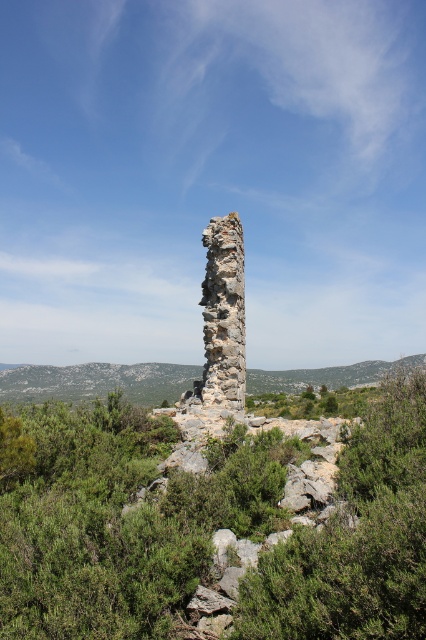
Between green leafy shrub at center and green mossy hillside at center, which one has less height?

With less height is green leafy shrub at center.

Is green leafy shrub at center to the right of green mossy hillside at center from the viewer's perspective?

Indeed, green leafy shrub at center is positioned on the right side of green mossy hillside at center.

Which is behind, point (409, 499) or point (114, 378)?

The point (114, 378) is behind.

The height and width of the screenshot is (640, 426). Find the location of `green leafy shrub at center`. green leafy shrub at center is located at coordinates (354, 540).

Can you confirm if green leafy shrubs at center is shorter than green mossy hillside at center?

Yes, green leafy shrubs at center is shorter than green mossy hillside at center.

Which is behind, point (58, 406) or point (296, 371)?

The point (296, 371) is behind.

Does point (39, 412) come behind point (146, 368)?

No, it is not.

Locate an element on the screen. The image size is (426, 640). green leafy shrubs at center is located at coordinates (120, 522).

Can you confirm if green leafy shrubs at center is positioned above green leafy shrub at center?

No, green leafy shrubs at center is not above green leafy shrub at center.

Image resolution: width=426 pixels, height=640 pixels. What do you see at coordinates (120, 522) in the screenshot?
I see `green leafy shrubs at center` at bounding box center [120, 522].

You are a GUI agent. You are given a task and a screenshot of the screen. Output one action in this format:
    pyautogui.click(x=<x>, y=<y>)
    Task: Click on the green leafy shrubs at center
    
    Given the screenshot: What is the action you would take?
    (120, 522)